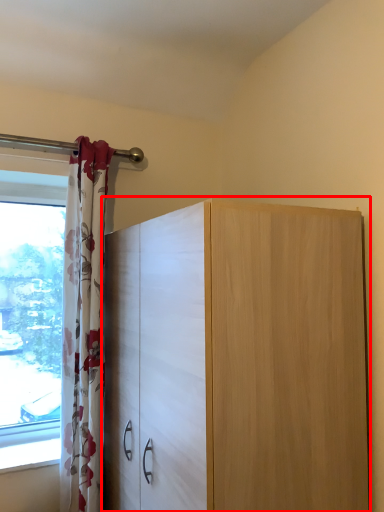
Question: From the image's perspective, what is the correct spatial positioning of cupboard (annotated by the red box) in reference to curtain?

Choices:
 (A) above
 (B) below

Answer: (B)